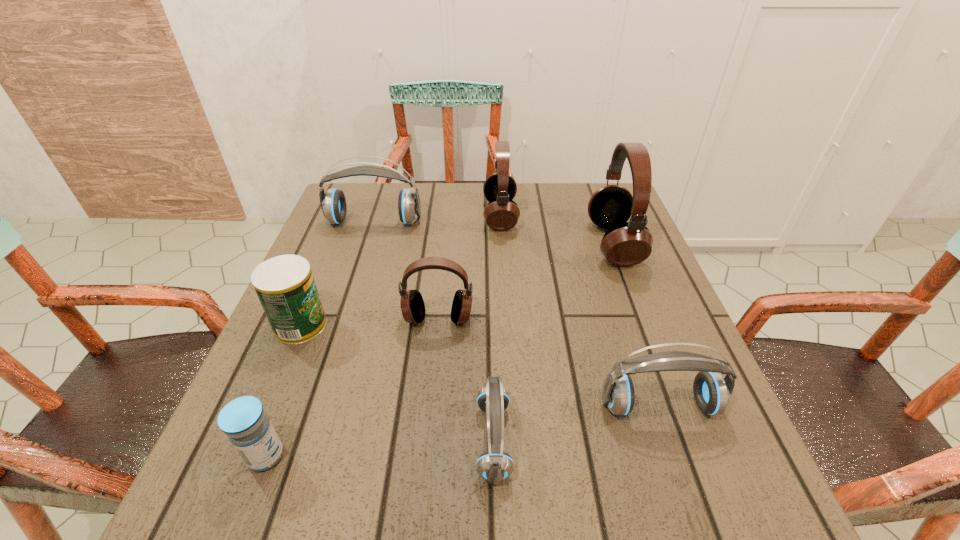
Identify which object is the sixth closest to the biggest black headset. Please provide its 2D coordinates. Your answer should be formatted as a tuple, i.e. [(x, y)], where the tuple contains the x and y coordinates of a point satisfying the conditions above.

[(285, 286)]

Locate an element on the screen. Image resolution: width=960 pixels, height=540 pixels. headset that can be found as the closest to the rightmost blue headset is located at coordinates (494, 466).

The width and height of the screenshot is (960, 540). What are the coordinates of `the second closest headset relative to the second black headset from left to right` in the screenshot? It's located at (625, 244).

The image size is (960, 540). Find the location of `black headset that is the closest to the blue medicine`. black headset that is the closest to the blue medicine is located at coordinates (412, 304).

The image size is (960, 540). In order to click on the closest black headset to the can in this screenshot , I will do `click(412, 304)`.

Identify the location of the third closest blue headset to the nearest black headset. Image resolution: width=960 pixels, height=540 pixels. (333, 203).

Locate which blue headset is the second closest to the can. Please provide its 2D coordinates. Your answer should be formatted as a tuple, i.e. [(x, y)], where the tuple contains the x and y coordinates of a point satisfying the conditions above.

[(494, 466)]

At what (x,y) coordinates should I click in order to perform the action: click on free space that satisfies the following two spatial constraints: 1. on the ear cups of the rightmost blue headset; 2. on the ear cups of the shortest headset. Please return your answer as a coordinate pair (x, y). This screenshot has width=960, height=540. Looking at the image, I should click on (671, 440).

The image size is (960, 540). What are the coordinates of `vacant area in the image that satisfies the following two spatial constraints: 1. on the ear pads of the tallest object; 2. on the ear pads of the leftmost black headset` in the screenshot? It's located at (642, 319).